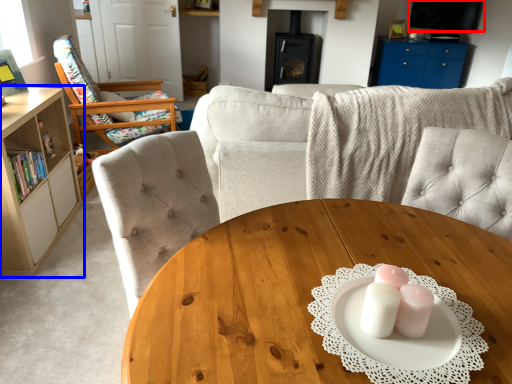
Question: Which of the following is the closest to the observer, television (highlighted by a red box) or cabinetry (highlighted by a blue box)?

Choices:
 (A) television
 (B) cabinetry

Answer: (B)